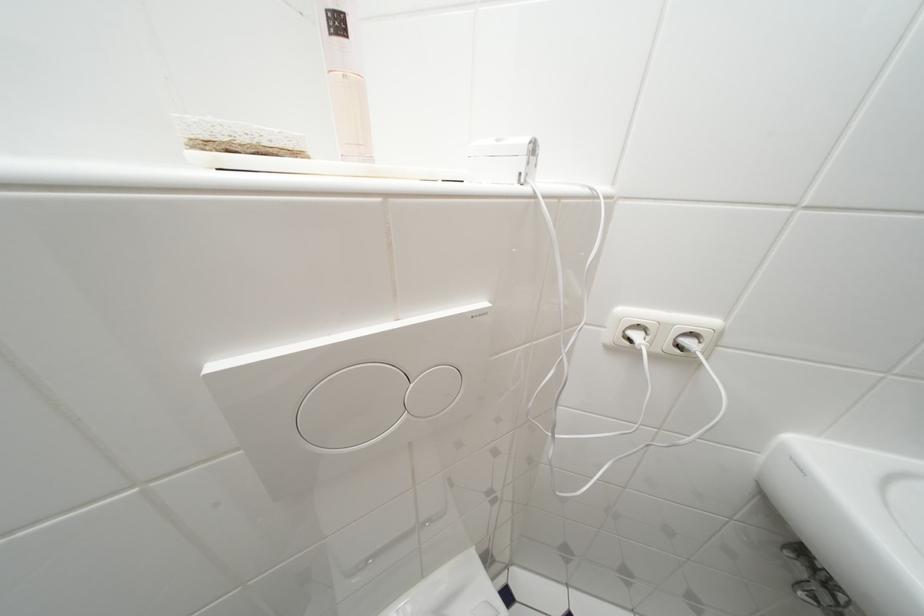
This screenshot has height=616, width=924. Describe the element at coordinates (353, 406) in the screenshot. I see `the large flush button` at that location.